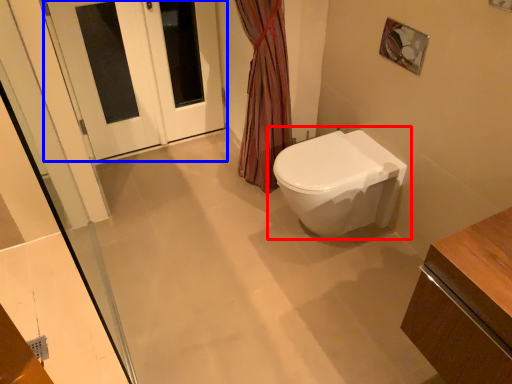
Question: Which point is further to the camera, toilet (highlighted by a red box) or door (highlighted by a blue box)?

Choices:
 (A) toilet
 (B) door

Answer: (B)